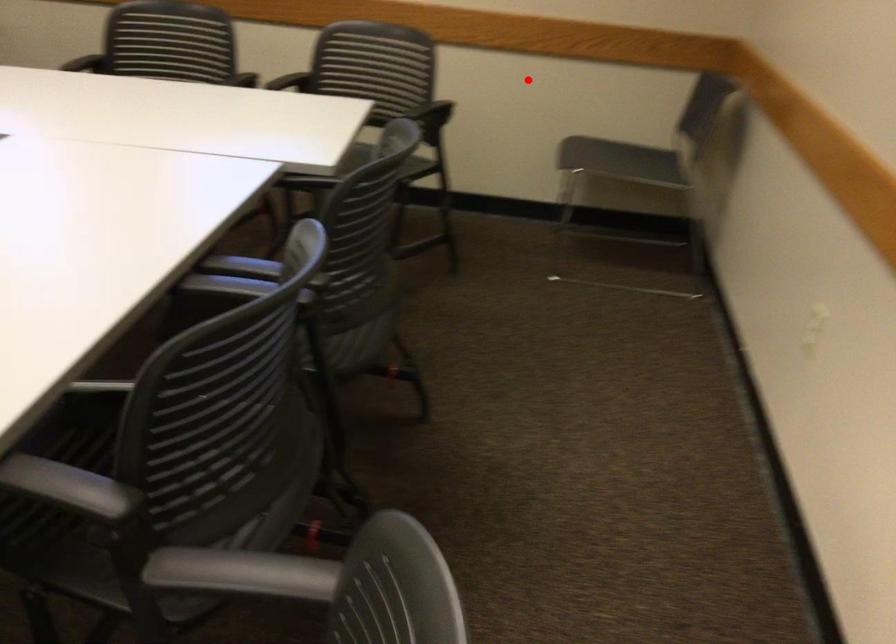
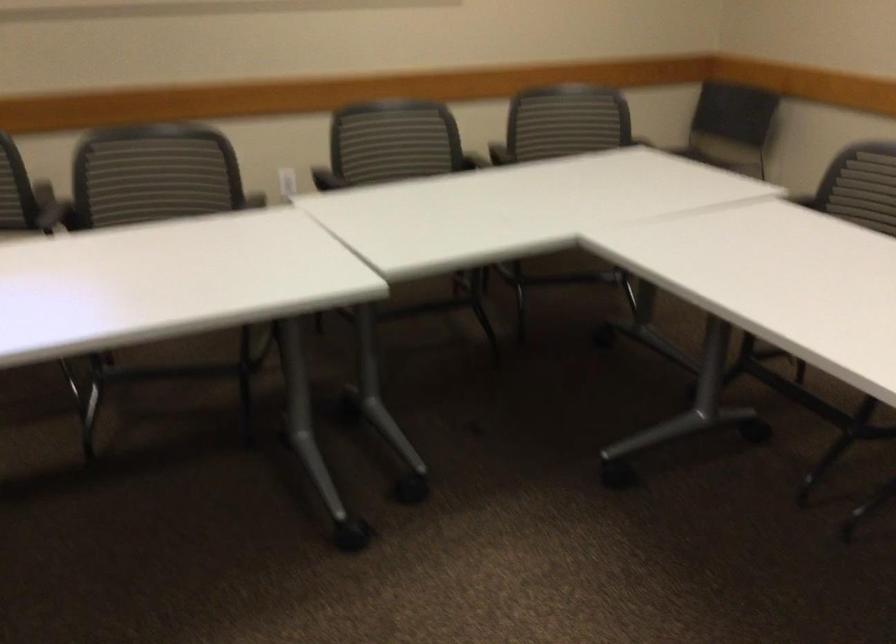
Find the pixel in the second image that matches the highlighted location in the first image.

(569, 114)